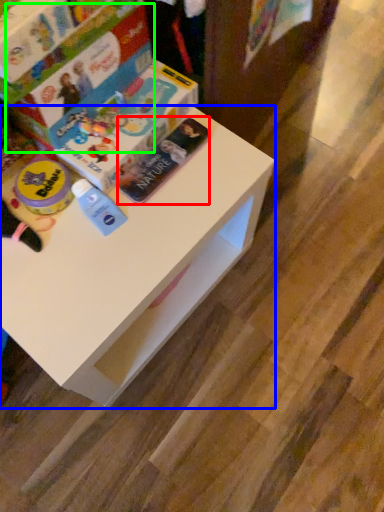
Question: Which is farther away from paperback book (highlighted by a red box)? table (highlighted by a blue box) or paperback book (highlighted by a green box)?

Choices:
 (A) table
 (B) paperback book

Answer: (A)